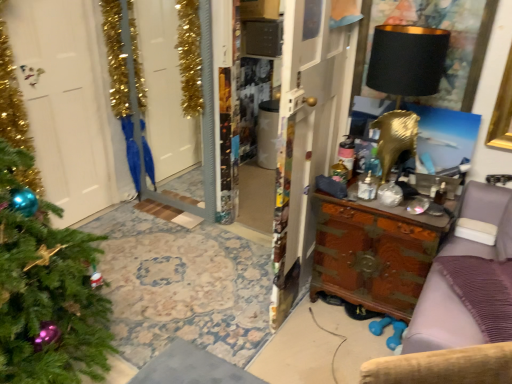
Question: From the image's perspective, would you say green matte christmas tree at left is positioned over black matte lampshade at upper right?

Choices:
 (A) yes
 (B) no

Answer: (B)

Question: Does green matte christmas tree at left appear on the left side of black matte lampshade at upper right?

Choices:
 (A) yes
 (B) no

Answer: (A)

Question: Does green matte christmas tree at left have a larger size compared to black matte lampshade at upper right?

Choices:
 (A) yes
 (B) no

Answer: (A)

Question: Can you confirm if green matte christmas tree at left is wider than black matte lampshade at upper right?

Choices:
 (A) no
 (B) yes

Answer: (B)

Question: Does green matte christmas tree at left have a smaller size compared to black matte lampshade at upper right?

Choices:
 (A) yes
 (B) no

Answer: (B)

Question: From the image's perspective, does green matte christmas tree at left appear lower than black matte lampshade at upper right?

Choices:
 (A) no
 (B) yes

Answer: (B)

Question: Would you say wooden chest at right is a long distance from wooden chest of drawers at right?

Choices:
 (A) yes
 (B) no

Answer: (B)

Question: From the image's perspective, is wooden chest at right on wooden chest of drawers at right?

Choices:
 (A) no
 (B) yes

Answer: (B)

Question: Is wooden chest at right smaller than wooden chest of drawers at right?

Choices:
 (A) no
 (B) yes

Answer: (B)

Question: Is wooden chest of drawers at right located within wooden chest at right?

Choices:
 (A) no
 (B) yes

Answer: (A)

Question: Is wooden chest of drawers at right at the back of wooden chest at right?

Choices:
 (A) yes
 (B) no

Answer: (B)

Question: Can you confirm if wooden chest at right is wider than wooden chest of drawers at right?

Choices:
 (A) yes
 (B) no

Answer: (A)

Question: Is gold metallic screen door at upper left positioned with its back to black fabric picture frame at upper right?

Choices:
 (A) yes
 (B) no

Answer: (B)